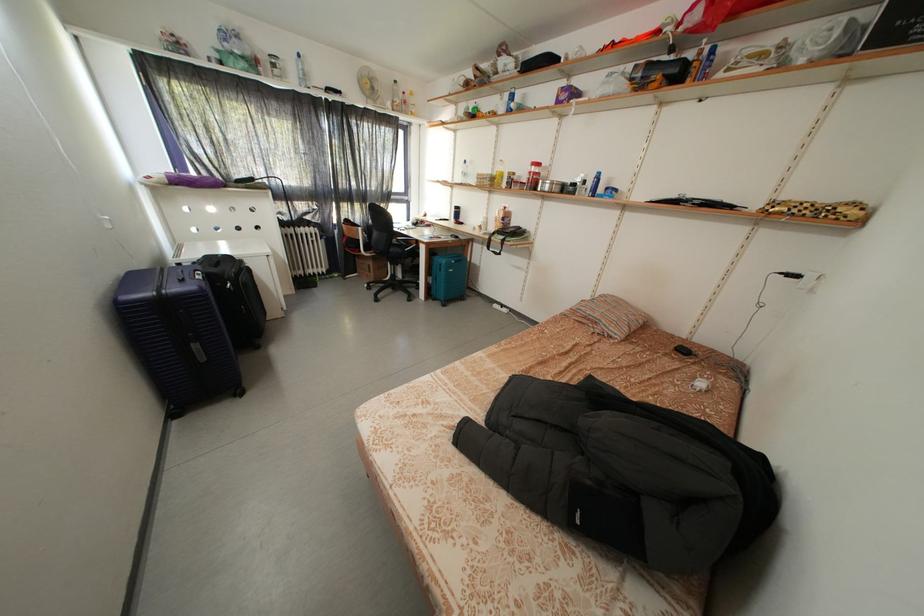
You are a GUI agent. You are given a task and a screenshot of the screen. Output one action in this format:
    pyautogui.click(x=<x>, y=<y>)
    Task: Click on the chair armrest
    The height and width of the screenshot is (616, 924).
    Given the screenshot: What is the action you would take?
    pyautogui.click(x=405, y=246)